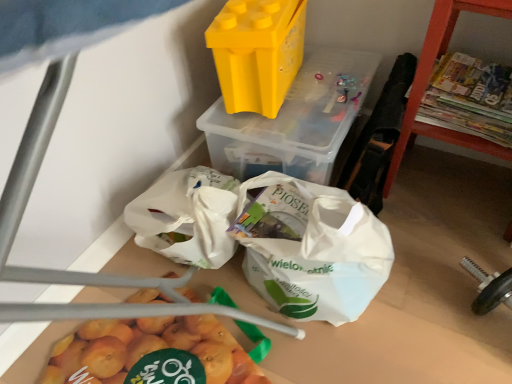
Identify the location of vacant region below orange wood shelf at right (from a real-world perspective). The height and width of the screenshot is (384, 512). (449, 185).